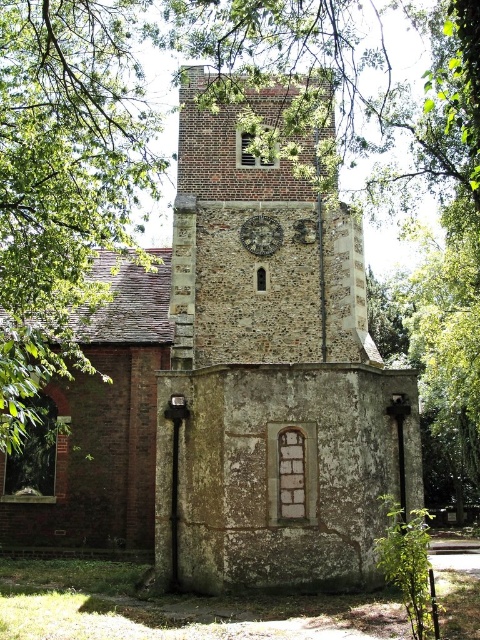
Is stone clock tower at center wider than rustic stone clock at center?

Yes, stone clock tower at center is wider than rustic stone clock at center.

Can you confirm if stone clock tower at center is smaller than rustic stone clock at center?

No, stone clock tower at center is not smaller than rustic stone clock at center.

The height and width of the screenshot is (640, 480). I want to click on stone clock tower at center, so click(238, 387).

Where is `stone clock tower at center`? stone clock tower at center is located at coordinates (238, 387).